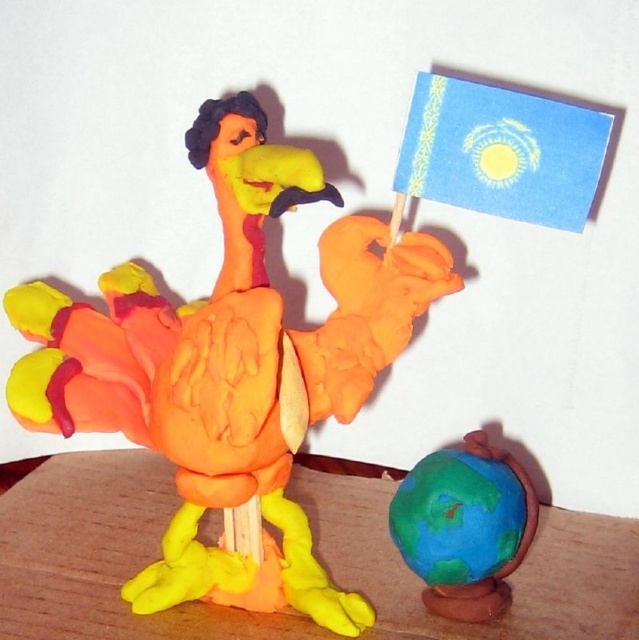
Does point (100, 609) lie in front of point (404, 490)?

Yes, it is.

Does wooden table at lower center have a larger size compared to earth-like clay globe at lower right?

Yes.

Image resolution: width=639 pixels, height=640 pixels. What do you see at coordinates (104, 556) in the screenshot?
I see `wooden table at lower center` at bounding box center [104, 556].

Identify the location of wooden table at lower center. (104, 556).

Between blue paper flag at upper right and earth-like clay globe at lower right, which one appears on the right side from the viewer's perspective?

From the viewer's perspective, blue paper flag at upper right appears more on the right side.

From the picture: Between blue paper flag at upper right and earth-like clay globe at lower right, which one is positioned higher?

Positioned higher is blue paper flag at upper right.

Identify the location of blue paper flag at upper right. (498, 152).

I want to click on blue paper flag at upper right, so click(x=498, y=152).

Is point (288, 476) behind point (466, 444)?

That is False.

Does matte clay bird at center have a greater width compared to earth-like clay globe at lower right?

Yes.

At what (x,y) coordinates should I click in order to perform the action: click on matte clay bird at center. Please return your answer as a coordinate pair (x, y). This screenshot has height=640, width=639. Looking at the image, I should click on (231, 369).

Locate an element on the screen. Image resolution: width=639 pixels, height=640 pixels. matte clay bird at center is located at coordinates (231, 369).